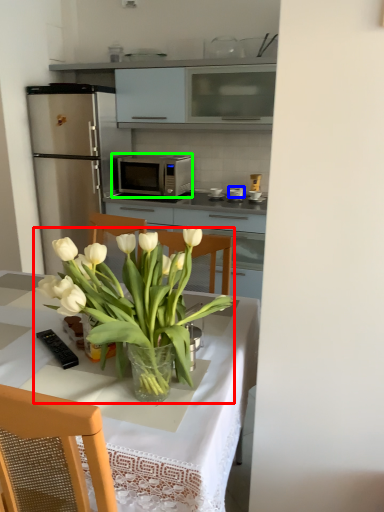
Question: Estimate the real-world distances between objects in this image. Which object is farther from houseplant (highlighted by a red box), appliance (highlighted by a blue box) or microwave oven (highlighted by a green box)?

Choices:
 (A) appliance
 (B) microwave oven

Answer: (A)